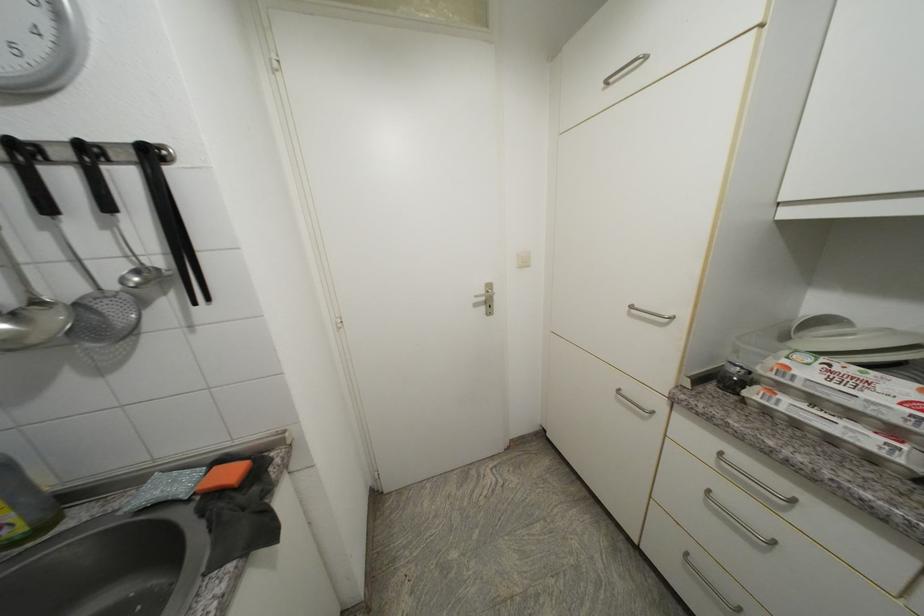
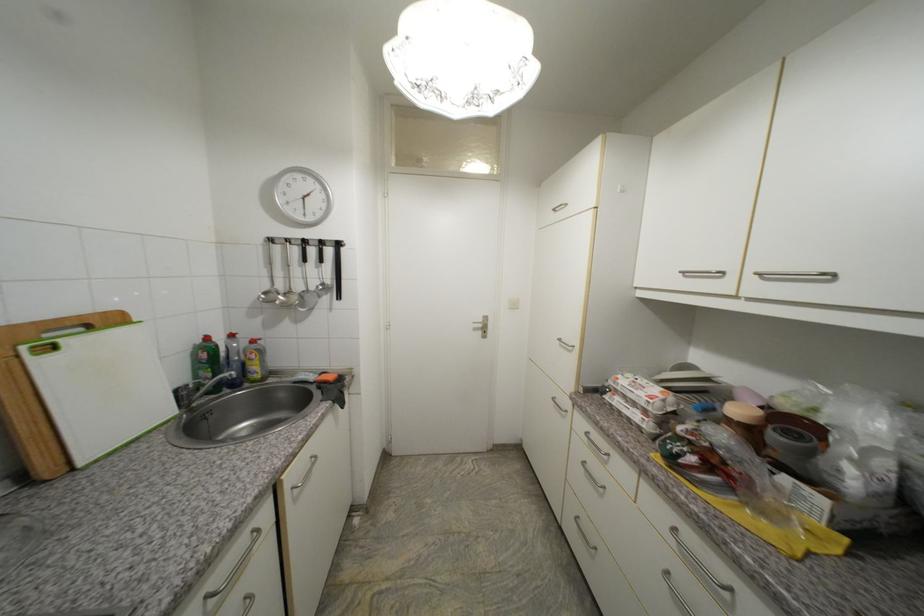
Find the pixel in the second image that matches pixel 786 410 in the first image.

(619, 405)